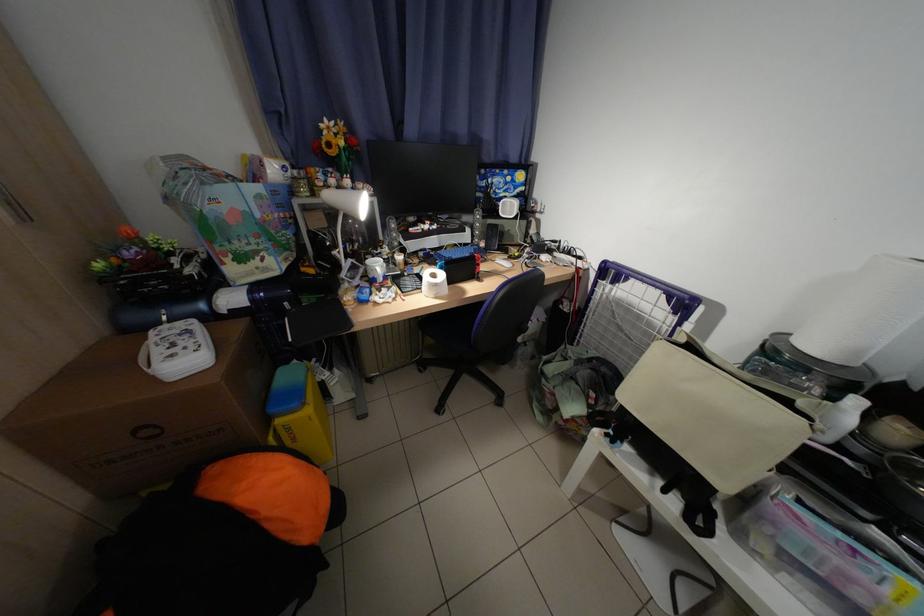
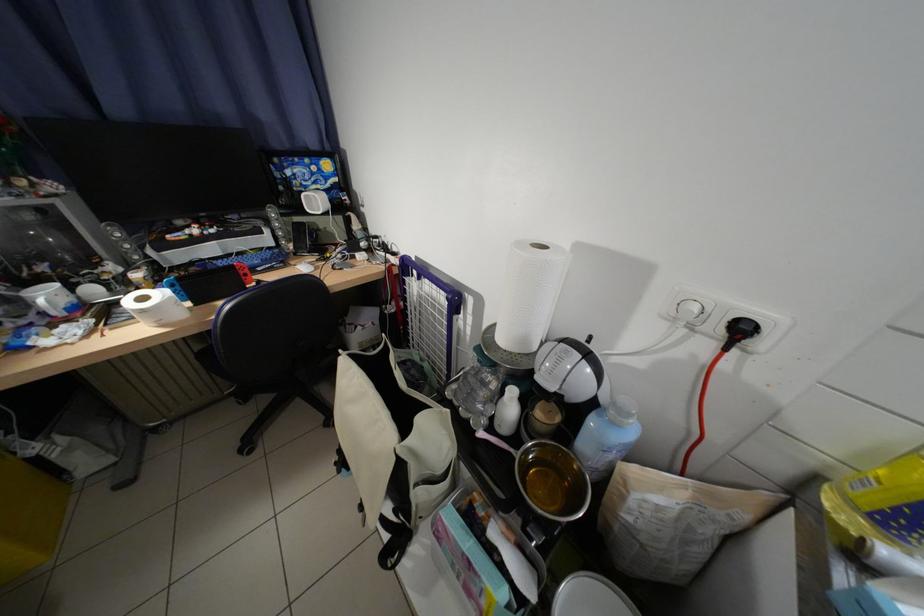
The point at (857, 460) is marked in the first image. Where is the corresponding point in the second image?

(524, 453)